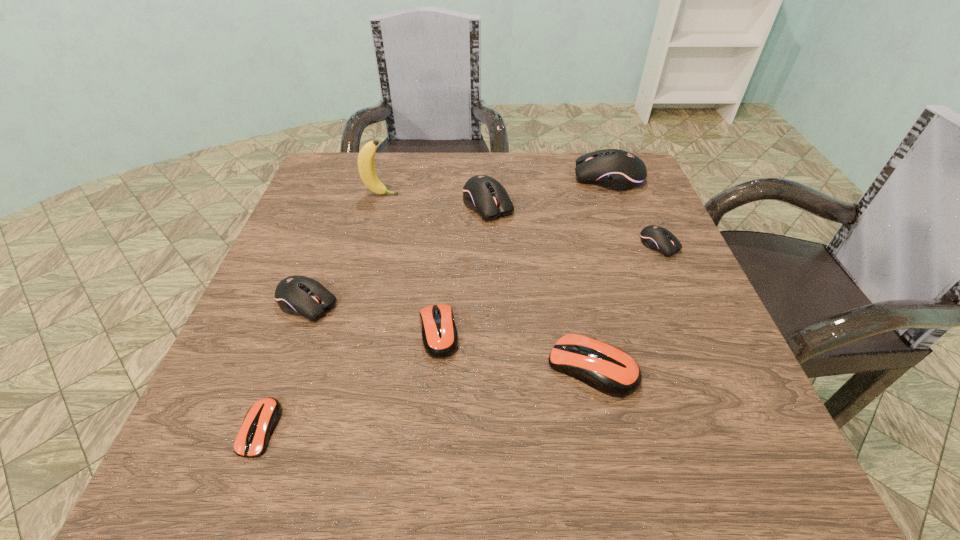
Identify the location of vacant position located on the right of the nearest object. The height and width of the screenshot is (540, 960). point(372,428).

Where is `banana present at the far edge`? The height and width of the screenshot is (540, 960). banana present at the far edge is located at coordinates (366, 167).

The height and width of the screenshot is (540, 960). Find the location of `object situated at the near edge`. object situated at the near edge is located at coordinates (260, 421).

Where is `banana located at the left edge`? The height and width of the screenshot is (540, 960). banana located at the left edge is located at coordinates (366, 167).

At what (x,y) coordinates should I click in order to perform the action: click on object that is at the far left corner. Please return your answer as a coordinate pair (x, y). Looking at the image, I should click on (366, 167).

Where is `object located in the near left corner section of the desktop`? This screenshot has height=540, width=960. object located in the near left corner section of the desktop is located at coordinates (260, 421).

What are the coordinates of `object located at the far right corner` in the screenshot? It's located at (615, 169).

Find the location of a particular element. blank space at the far edge of the desktop is located at coordinates (492, 154).

This screenshot has width=960, height=540. I want to click on vacant space at the near edge of the desktop, so click(416, 487).

The height and width of the screenshot is (540, 960). I want to click on blank area at the left edge, so click(x=293, y=248).